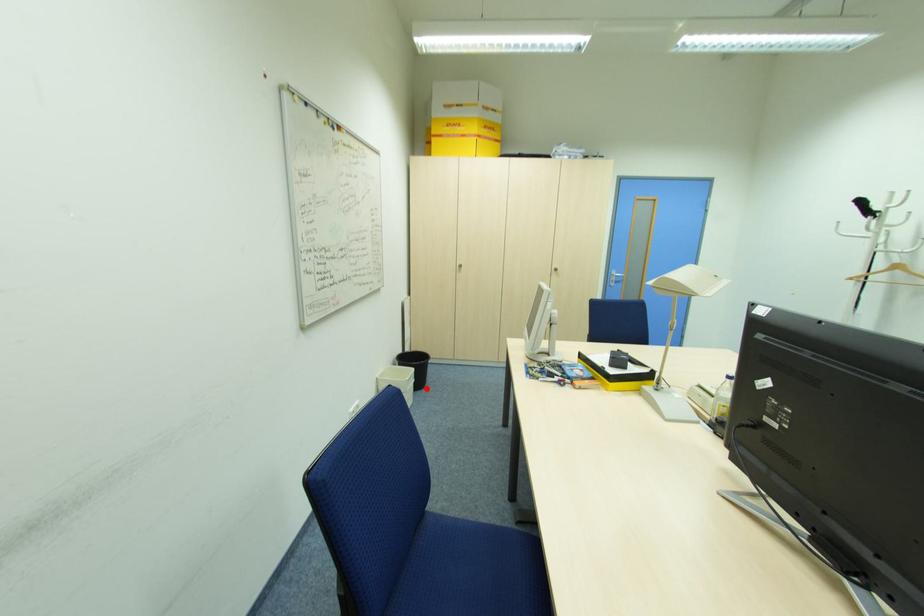
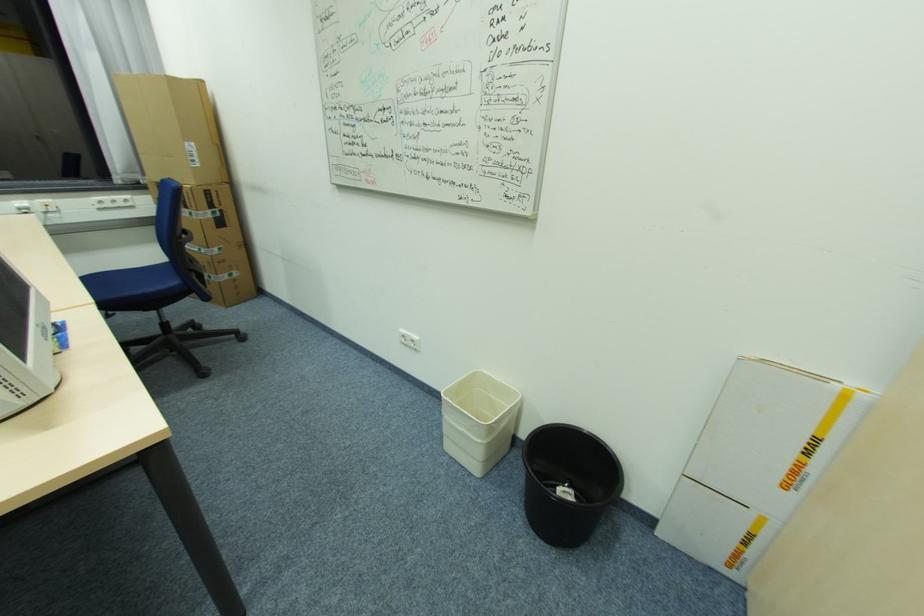
Question: I am providing you with two images of the same scene from different viewpoints. Image1 has a red point marked. In image2, the corresponding 3D location appears at what relative position? Reply with the corresponding letter.

Choices:
 (A) Closer
 (B) Farther

Answer: (A)